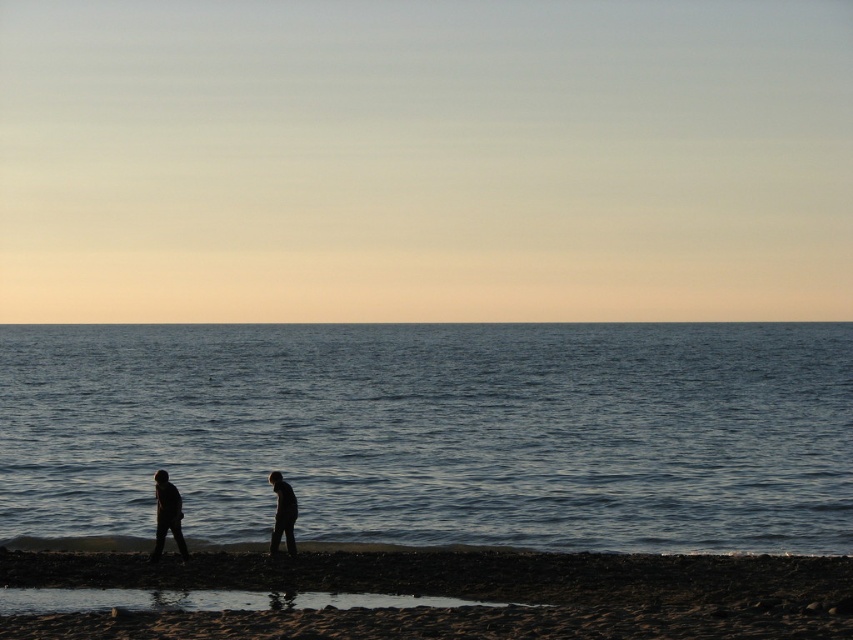
You are standing at the origin point of the coordinate system. You see two points marked on the beach, point (589, 448) and point (281, 476). Which point is closer to you?

Point (281, 476) is closer to you because it is in front of point (589, 448).

You are standing on the beach and see the dark sand at lower center and the silhouette figures at lower center. Which object is closer to the horizon?

The silhouette figures at lower center are closer to the horizon than the dark sand at lower center because the dark sand is below them.